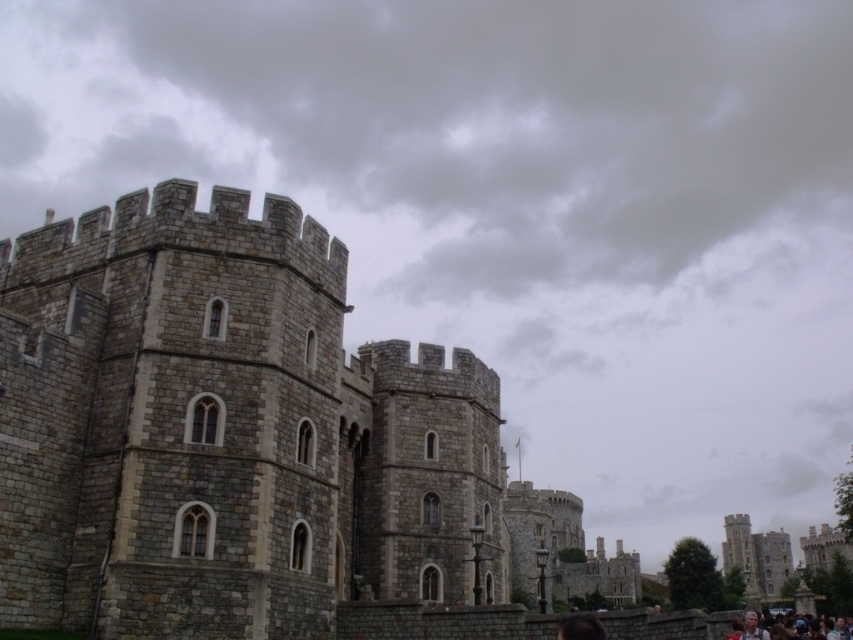
From the picture: Which is below, stone castle at center or light brown hair at lower right?

Positioned lower is stone castle at center.

Where is `stone castle at center`? stone castle at center is located at coordinates (233, 435).